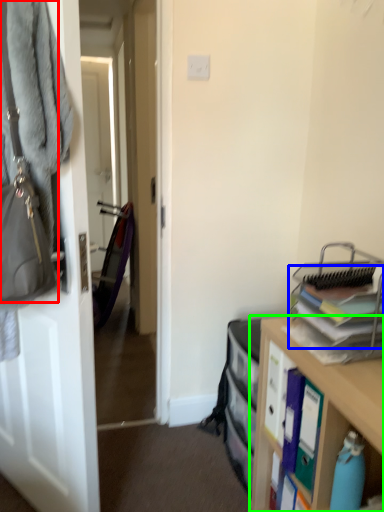
Question: Which object is the farthest from handbag (highlighted by a red box)? Choose among these: book (highlighted by a blue box) or cabinetry (highlighted by a green box).

Choices:
 (A) book
 (B) cabinetry

Answer: (B)